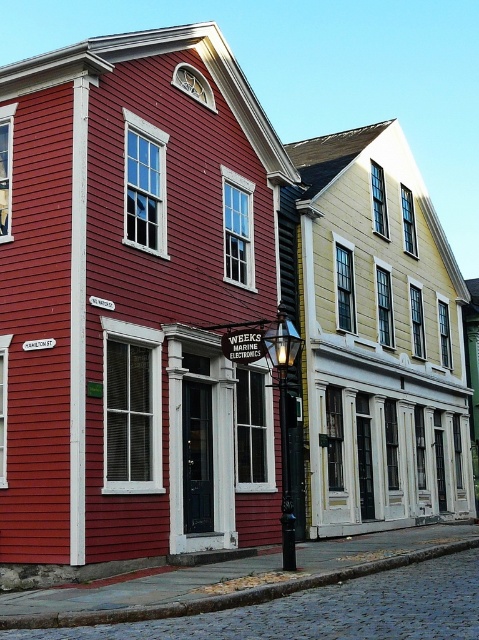
Question: Does white wood trim at upper center appear over white wood trim at center?

Choices:
 (A) no
 (B) yes

Answer: (B)

Question: Which point appears farthest from the camera in this image?

Choices:
 (A) (34, 323)
 (B) (464, 448)

Answer: (B)

Question: Is white wood trim at upper center smaller than white wood trim at center?

Choices:
 (A) yes
 (B) no

Answer: (A)

Question: Which object appears farthest from the camera in this image?

Choices:
 (A) white wood trim at center
 (B) white wood trim at upper center

Answer: (A)

Question: Which object is closer to the camera taking this photo?

Choices:
 (A) white wood trim at upper center
 (B) white wood trim at center

Answer: (A)

Question: Can you confirm if white wood trim at upper center is positioned to the left of white wood trim at center?

Choices:
 (A) no
 (B) yes

Answer: (B)